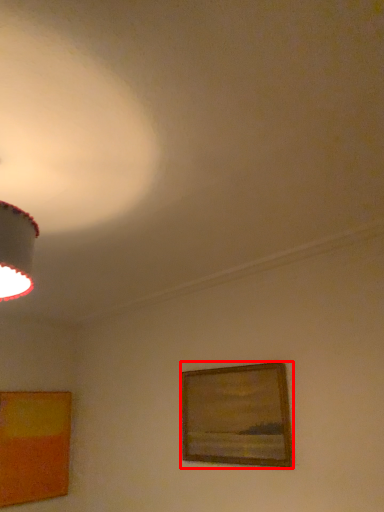
Question: From the image's perspective, considering the relative positions of picture frame (annotated by the red box) and picture frame in the image provided, where is picture frame (annotated by the red box) located with respect to the staircase?

Choices:
 (A) above
 (B) below

Answer: (A)